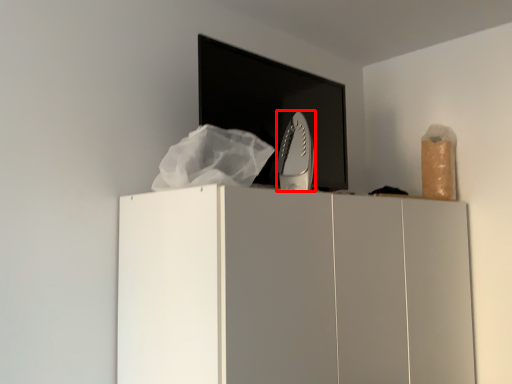
Question: From the image's perspective, what is the correct spatial relationship of home appliance (annotated by the red box) in relation to cupboard?

Choices:
 (A) above
 (B) below

Answer: (A)